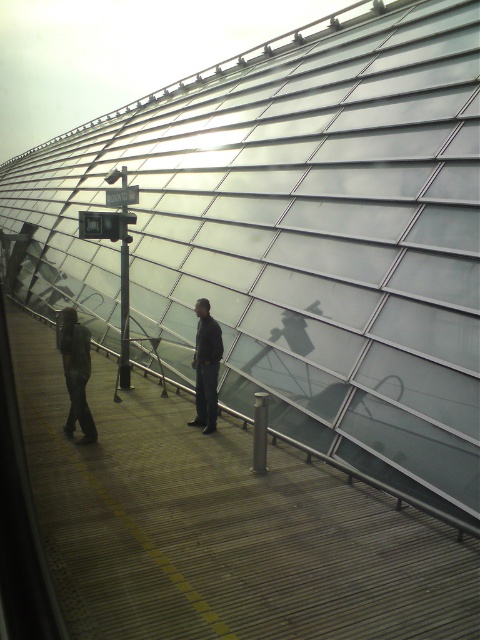
Question: Does dark gray jeans at left have a smaller size compared to dark gray jacket at center?

Choices:
 (A) no
 (B) yes

Answer: (A)

Question: Considering the real-world distances, which object is closest to the dark gray jacket at center?

Choices:
 (A) wooden walkway at center
 (B) dark gray jeans at left

Answer: (B)

Question: Does wooden walkway at center have a greater width compared to dark gray jacket at center?

Choices:
 (A) no
 (B) yes

Answer: (B)

Question: Which object is positioned closest to the wooden walkway at center?

Choices:
 (A) dark gray jeans at left
 (B) dark gray jacket at center

Answer: (A)

Question: Which is nearer to the wooden walkway at center?

Choices:
 (A) dark gray jeans at left
 (B) dark gray jacket at center

Answer: (A)

Question: Does wooden walkway at center have a greater width compared to dark gray jacket at center?

Choices:
 (A) no
 (B) yes

Answer: (B)